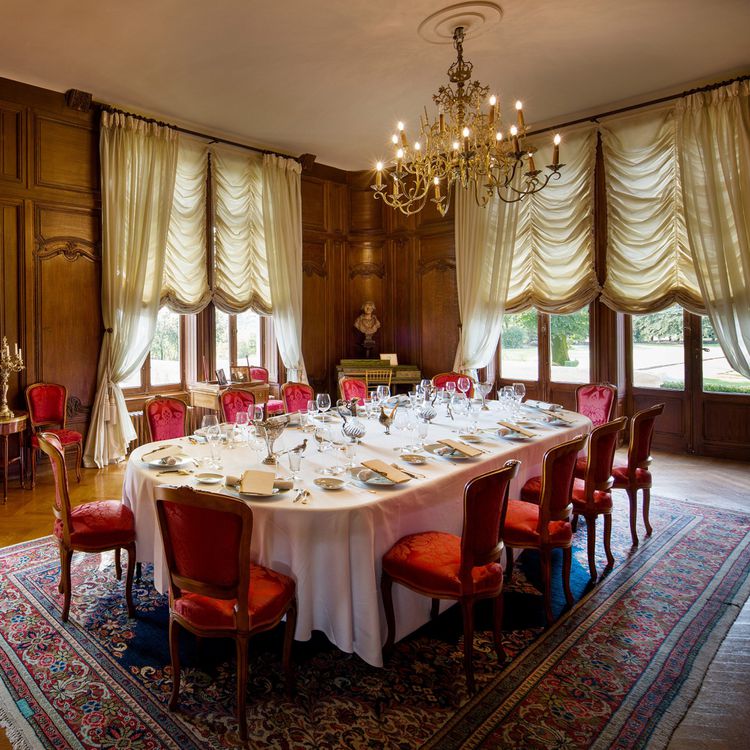
Locate an element on the screen. ceiling is located at coordinates (652, 30).